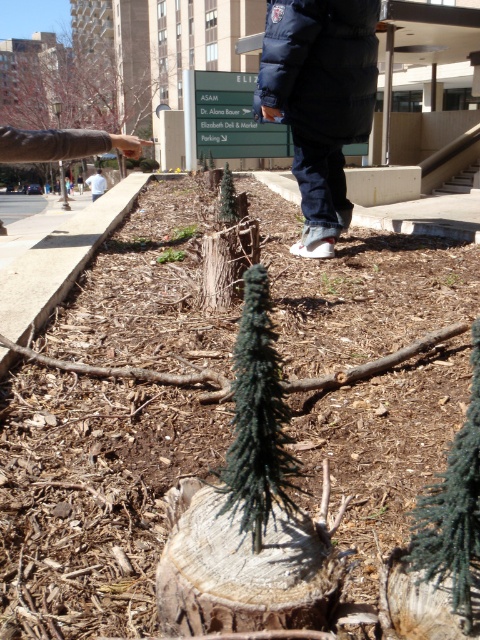
You are standing at the lower edge of the image, looking towards the upper center. You notice both the navy blue puffer jacket at upper center and the green artificial tree at upper center. Which object is closer to you?

Both the navy blue puffer jacket at upper center and the green artificial tree at upper center are located at the same distance from you since they are both positioned at upper center in the scene.

You are standing at the point with coordinates point (52, 72) and want to walk towards the point with coordinates point (241, 518). Which direction should you move relative to your current position?

You should move forward because point (241, 518) is in front of point (52, 72).

You are a photographer trying to capture both the navy blue puffer jacket at upper center and the green matte pine at center in a single frame. Which object should you focus on first to ensure both are in the frame without moving the camera?

You should focus on the navy blue puffer jacket at upper center first since it is larger in size than the green matte pine at center, allowing you to frame it while still capturing the smaller pine in the same shot.